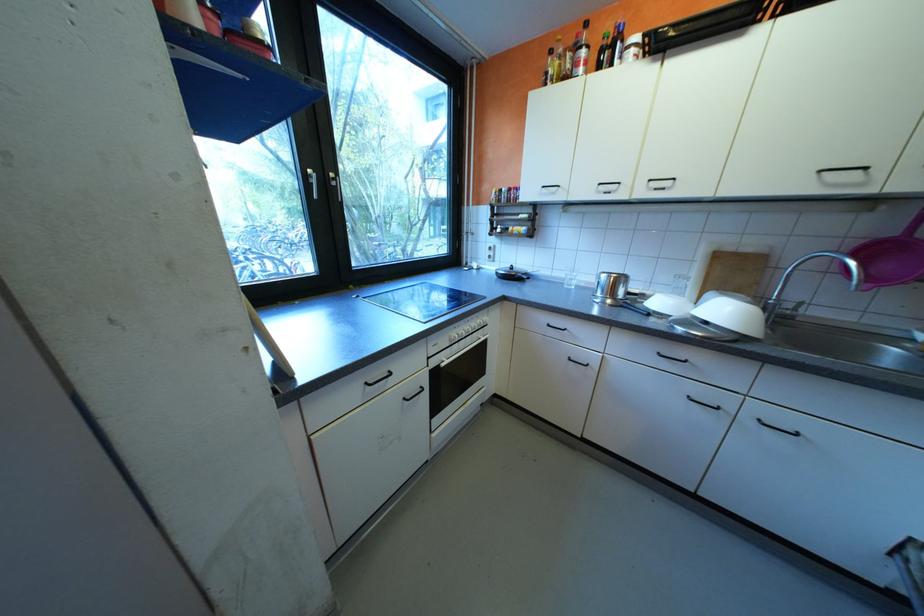
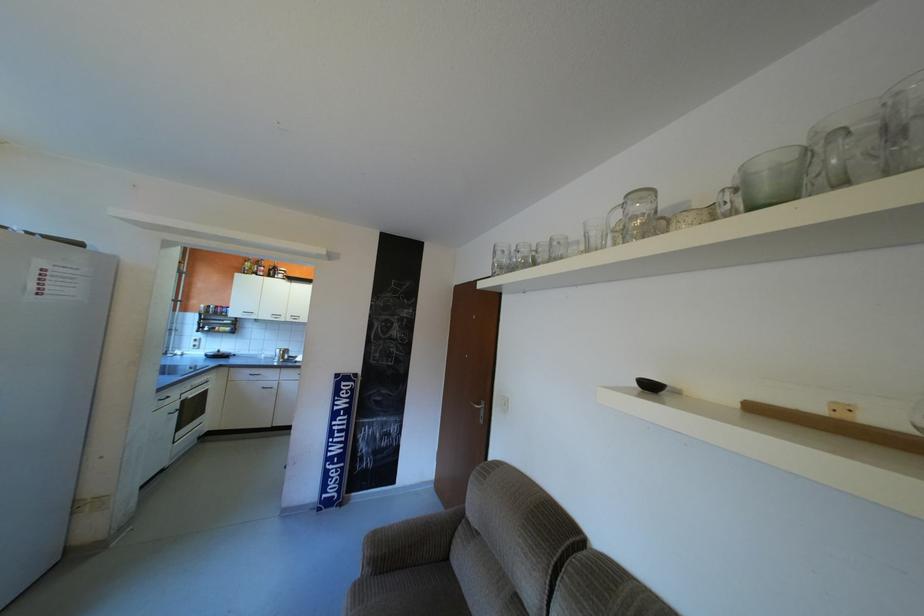
The point at (652, 192) is marked in the first image. Where is the corresponding point in the second image?

(300, 318)